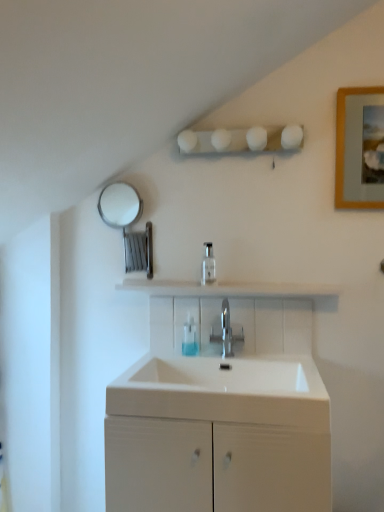
At what (x,y) coordinates should I click in order to perform the action: click on white glossy soap dispenser at center. Please return your answer as a coordinate pair (x, y). Looking at the image, I should click on (208, 264).

Image resolution: width=384 pixels, height=512 pixels. What do you see at coordinates (213, 467) in the screenshot?
I see `white matte cabinet at center` at bounding box center [213, 467].

Find the location of a particular element. The height and width of the screenshot is (512, 384). white matte light fixture at upper center is located at coordinates (240, 140).

What do you see at coordinates (240, 140) in the screenshot? I see `white matte light fixture at upper center` at bounding box center [240, 140].

Describe the element at coordinates (190, 338) in the screenshot. This screenshot has width=384, height=512. I see `translucent plastic soap dispenser at center` at that location.

The image size is (384, 512). What are the coordinates of `white glossy sink at center` in the screenshot? It's located at (224, 391).

Considering the sizes of objects white matte cabinet at center and white glossy shelf at center in the image provided, who is smaller, white matte cabinet at center or white glossy shelf at center?

white glossy shelf at center is smaller.

Consider the image. Is the surface of white matte cabinet at center in direct contact with white glossy shelf at center?

No, white matte cabinet at center is not in contact with white glossy shelf at center.

What's the angular difference between white matte cabinet at center and white glossy shelf at center's facing directions?

0.00597 degrees separate the facing orientations of white matte cabinet at center and white glossy shelf at center.

Looking at this image, considering the sizes of objects white matte cabinet at center and white glossy shelf at center in the image provided, who is taller, white matte cabinet at center or white glossy shelf at center?

white matte cabinet at center is taller.

Is white glossy sink at center looking in the opposite direction of wooden picture frame at upper right?

No, white glossy sink at center's orientation is not away from wooden picture frame at upper right.

Is white glossy sink at center further to camera compared to wooden picture frame at upper right?

No, white glossy sink at center is closer to the camera.

From the image's perspective, which one is positioned higher, white glossy sink at center or wooden picture frame at upper right?

From the image's view, wooden picture frame at upper right is above.

Does polished metallic tap at center have a smaller size compared to wooden picture frame at upper right?

Yes.

Considering the positions of point (242, 336) and point (367, 152), is point (242, 336) closer or farther from the camera than point (367, 152)?

Point (242, 336).

Does polished metallic tap at center have a greater height compared to wooden picture frame at upper right?

No.

Considering the relative positions of polished metallic tap at center and wooden picture frame at upper right in the image provided, is polished metallic tap at center in front of wooden picture frame at upper right?

No, polished metallic tap at center is further to the viewer.

Is white glossy sink at center a part of wooden picture frame at upper right?

No, white glossy sink at center is not surrounded by wooden picture frame at upper right.

Is wooden picture frame at upper right facing towards white glossy sink at center?

No.

Is wooden picture frame at upper right to the left of white glossy sink at center from the viewer's perspective?

Incorrect, wooden picture frame at upper right is not on the left side of white glossy sink at center.

Can you see wooden picture frame at upper right touching white glossy sink at center?

No, wooden picture frame at upper right is not next to white glossy sink at center.

Is white glossy soap dispenser at center far away from polished metallic tap at center?

No, white glossy soap dispenser at center is not far from polished metallic tap at center.

Which of these two, white glossy soap dispenser at center or polished metallic tap at center, is bigger?

polished metallic tap at center.

Considering the relative positions of white glossy soap dispenser at center and polished metallic tap at center in the image provided, is white glossy soap dispenser at center behind polished metallic tap at center?

Yes.

Is white glossy soap dispenser at center facing towards polished metallic tap at center?

No, white glossy soap dispenser at center is not facing towards polished metallic tap at center.

Does point (349, 155) appear closer or farther from the camera than point (196, 334)?

Point (349, 155).

From the image's perspective, would you say wooden picture frame at upper right is shown under translucent plastic soap dispenser at center?

No, from the image's perspective, wooden picture frame at upper right is not beneath translucent plastic soap dispenser at center.

From a real-world perspective, is wooden picture frame at upper right located beneath translucent plastic soap dispenser at center?

No, from a real-world perspective, wooden picture frame at upper right is not below translucent plastic soap dispenser at center.

Can you confirm if wooden picture frame at upper right is positioned to the right of translucent plastic soap dispenser at center?

Correct, you'll find wooden picture frame at upper right to the right of translucent plastic soap dispenser at center.

Which of these two, white glossy shelf at center or polished metallic tap at center, stands taller?

polished metallic tap at center.

Is white glossy shelf at center bigger or smaller than polished metallic tap at center?

white glossy shelf at center is bigger than polished metallic tap at center.

From a real-world perspective, is white glossy shelf at center located higher than polished metallic tap at center?

Indeed, from a real-world perspective, white glossy shelf at center stands above polished metallic tap at center.

Is white glossy shelf at center inside or outside of polished metallic tap at center?

white glossy shelf at center exists outside the volume of polished metallic tap at center.

Identify the location of drawer that appears below the white glossy shelf at center (from a real-world perspective). click(x=213, y=467).

Identify the location of picture frame that is behind the white glossy sink at center. The image size is (384, 512). (360, 148).

Which object lies nearer to the anchor point polished metallic tap at center, white glossy soap dispenser at center or white glossy shelf at center?

Among the two, white glossy soap dispenser at center is located nearer to polished metallic tap at center.

Based on their spatial positions, is white matte cabinet at center or white glossy soap dispenser at center closer to translucent plastic soap dispenser at center?

Among the two, white glossy soap dispenser at center is located nearer to translucent plastic soap dispenser at center.

Looking at the image, which one is located closer to white matte light fixture at upper center, translucent plastic soap dispenser at center or polished metallic tap at center?

Based on the image, polished metallic tap at center appears to be nearer to white matte light fixture at upper center.

Which object lies further to the anchor point white glossy sink at center, translucent plastic soap dispenser at center or white glossy shelf at center?

The object further to white glossy sink at center is white glossy shelf at center.

From the picture: Which object lies further to the anchor point white glossy soap dispenser at center, white glossy sink at center or polished metallic tap at center?

Based on the image, white glossy sink at center appears to be further to white glossy soap dispenser at center.

Estimate the real-world distances between objects in this image. Which object is further from white glossy sink at center, wooden picture frame at upper right or white glossy shelf at center?

Among the two, wooden picture frame at upper right is located further to white glossy sink at center.

Estimate the real-world distances between objects in this image. Which object is closer to white glossy shelf at center, white matte cabinet at center or translucent plastic soap dispenser at center?

translucent plastic soap dispenser at center lies closer to white glossy shelf at center than the other object.

Considering their positions, is polished metallic tap at center positioned further to wooden picture frame at upper right than white glossy soap dispenser at center?

Based on the image, polished metallic tap at center appears to be further to wooden picture frame at upper right.

The image size is (384, 512). What are the coordinates of `soap dispenser between wooden picture frame at upper right and white glossy sink at center vertically` in the screenshot? It's located at (208, 264).

Locate an element on the screen. Image resolution: width=384 pixels, height=512 pixels. soap dispenser that lies between white matte light fixture at upper center and white glossy sink at center from top to bottom is located at coordinates (208, 264).

Where is `soap dispenser between white matte light fixture at upper center and translucent plastic soap dispenser at center vertically`? This screenshot has height=512, width=384. soap dispenser between white matte light fixture at upper center and translucent plastic soap dispenser at center vertically is located at coordinates point(208,264).

I want to click on toiletry between wooden picture frame at upper right and white matte cabinet at center from top to bottom, so click(190, 338).